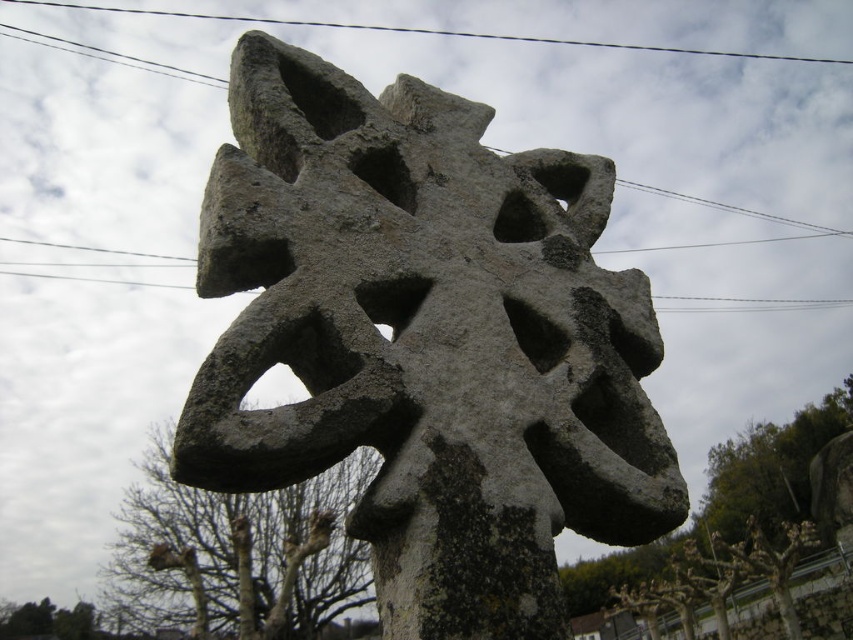
Question: Is gray stone cross at center to the left of black wire at upper center from the viewer's perspective?

Choices:
 (A) no
 (B) yes

Answer: (A)

Question: Does gray stone cross at center have a greater width compared to black wire at upper center?

Choices:
 (A) no
 (B) yes

Answer: (A)

Question: Can you confirm if gray stone cross at center is positioned to the left of black wire at upper center?

Choices:
 (A) no
 (B) yes

Answer: (A)

Question: Which point appears closest to the camera in this image?

Choices:
 (A) (755, 56)
 (B) (601, 515)

Answer: (B)

Question: Which point is closer to the camera?

Choices:
 (A) gray stone cross at center
 (B) black wire at upper center

Answer: (A)

Question: Among these points, which one is nearest to the camera?

Choices:
 (A) (431, 592)
 (B) (238, 19)

Answer: (A)